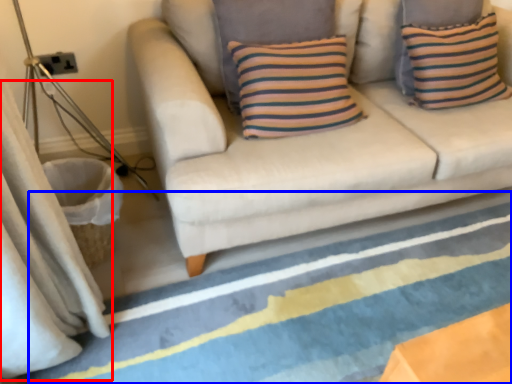
Question: Which object appears farthest to the camera in this image, curtain (highlighted by a red box) or strip (highlighted by a blue box)?

Choices:
 (A) curtain
 (B) strip

Answer: (B)